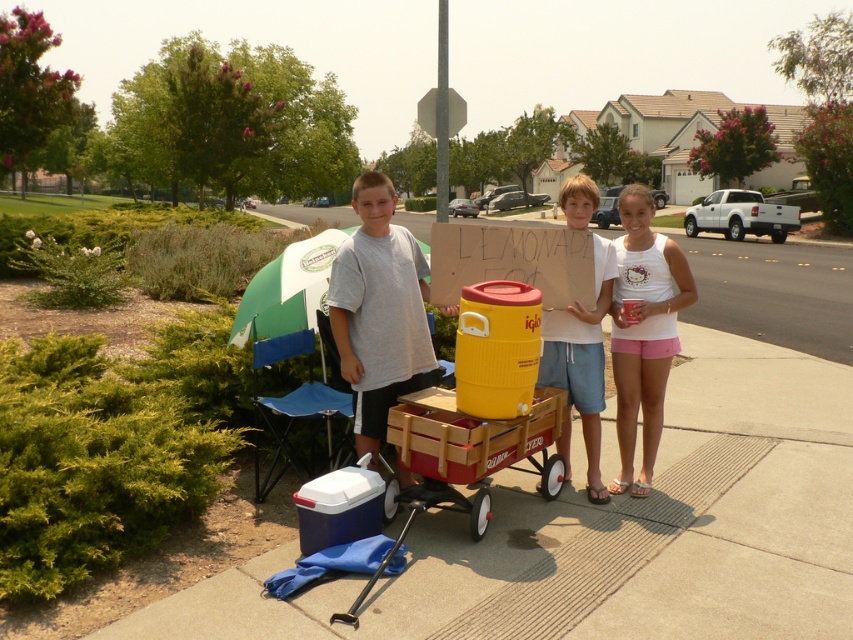
Question: Which of the following is the farthest from the observer?

Choices:
 (A) gray cotton t-shirt at center
 (B) light blue denim shorts at center
 (C) white cotton tank top at center
 (D) wooden wagon at center

Answer: (C)

Question: Which object is farther from the camera taking this photo?

Choices:
 (A) light blue denim shorts at center
 (B) gray cotton t-shirt at center
 (C) wooden wagon at center
 (D) white cotton tank top at center

Answer: (D)

Question: Does white cotton tank top at center appear on the right side of light blue denim shorts at center?

Choices:
 (A) no
 (B) yes

Answer: (B)

Question: Is gray cotton t-shirt at center positioned at the back of wooden wagon at center?

Choices:
 (A) no
 (B) yes

Answer: (B)

Question: Is wooden wagon at center below white cotton tank top at center?

Choices:
 (A) no
 (B) yes

Answer: (B)

Question: Based on their relative distances, which object is nearer to the gray cotton t-shirt at center?

Choices:
 (A) wooden wagon at center
 (B) light blue denim shorts at center

Answer: (A)